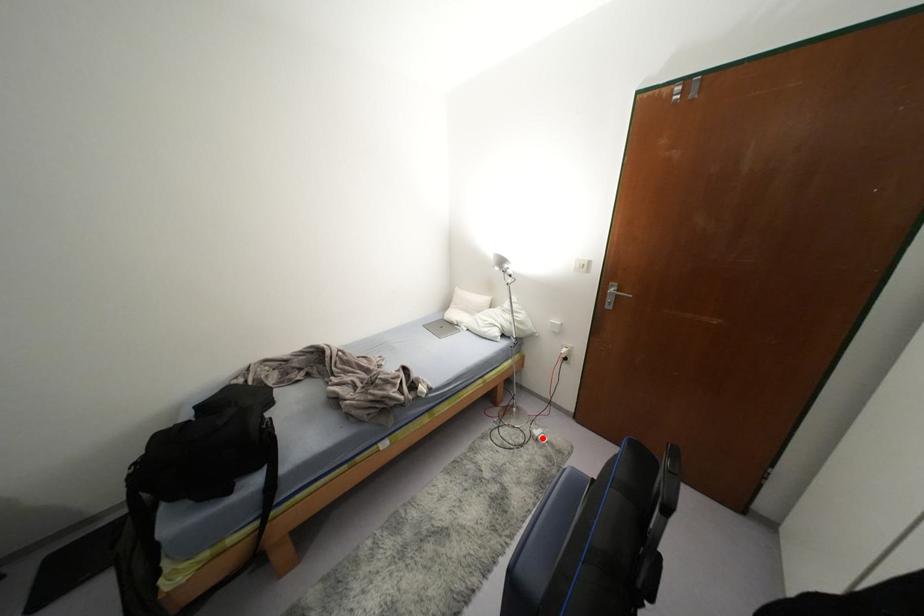
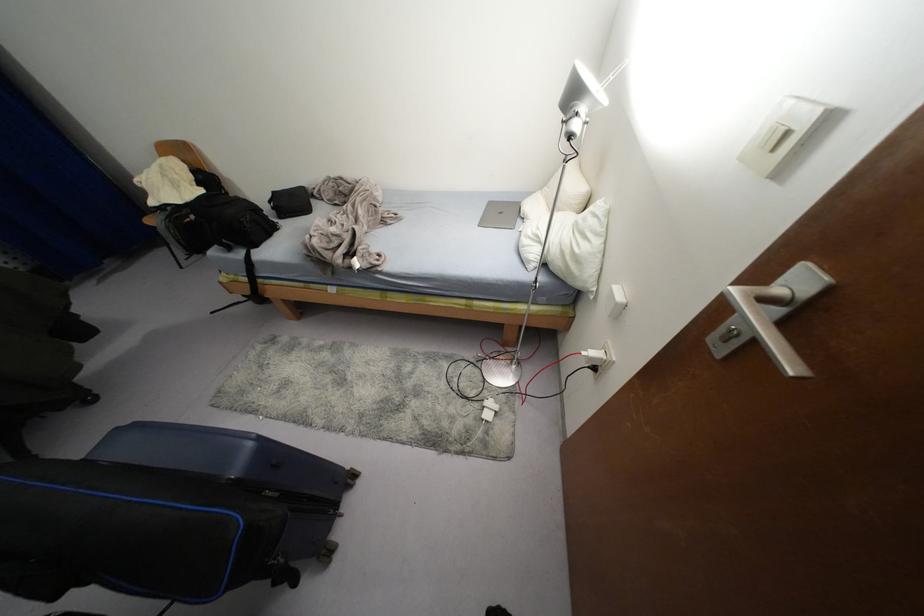
Locate, in the second image, the point that corresponds to the highlighted location in the first image.

(487, 416)